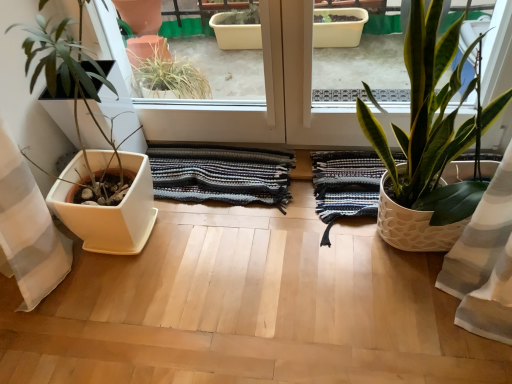
Question: Considering the positions of point (174, 192) and point (355, 175), is point (174, 192) closer or farther from the camera than point (355, 175)?

Choices:
 (A) closer
 (B) farther

Answer: (B)

Question: Is striped cotton rug at center, the 2th bath towel from the right, inside or outside of white textured bath towel at right, the first bath towel in the right-to-left sequence?

Choices:
 (A) inside
 (B) outside

Answer: (B)

Question: Which object is the farthest from the white textured bath towel at right, which is the second bath towel in left-to-right order?

Choices:
 (A) striped cotton rug at center, the 1th bath towel viewed from the left
 (B) white textured pot at right, positioned as the 2th houseplant in left-to-right order
 (C) white matte planter at left, placed as the second houseplant when sorted from right to left

Answer: (C)

Question: Which of these objects is positioned farthest from the white matte planter at left, placed as the second houseplant when sorted from right to left?

Choices:
 (A) white textured pot at right, positioned as the 2th houseplant in left-to-right order
 (B) white textured bath towel at right, the first bath towel in the right-to-left sequence
 (C) striped cotton rug at center, the 1th bath towel viewed from the left

Answer: (A)